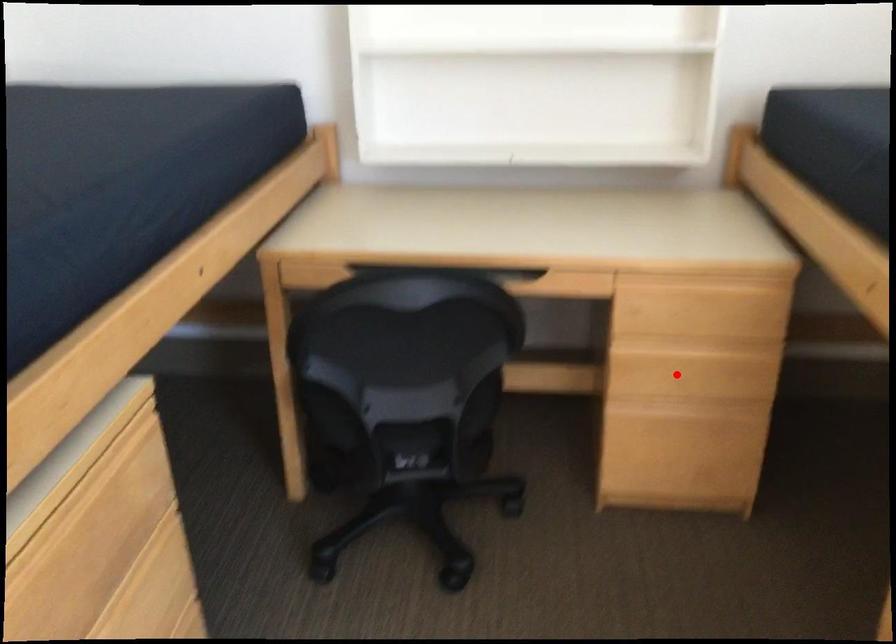
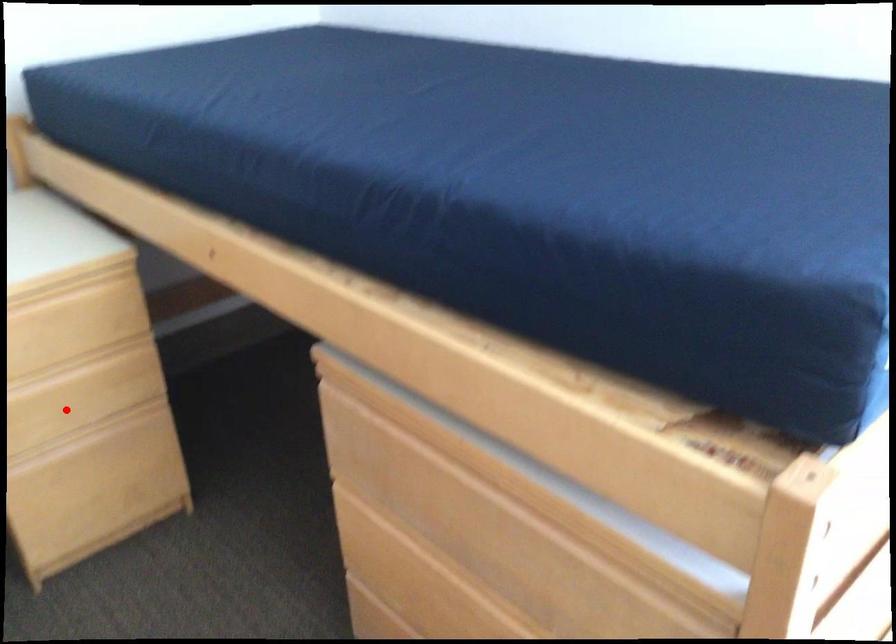
I am providing you with two images of the same scene from different viewpoints. A red point is marked on the first image and another point is marked on the second image. Do the highlighted points in image1 and image2 indicate the same real-world spot?

Yes